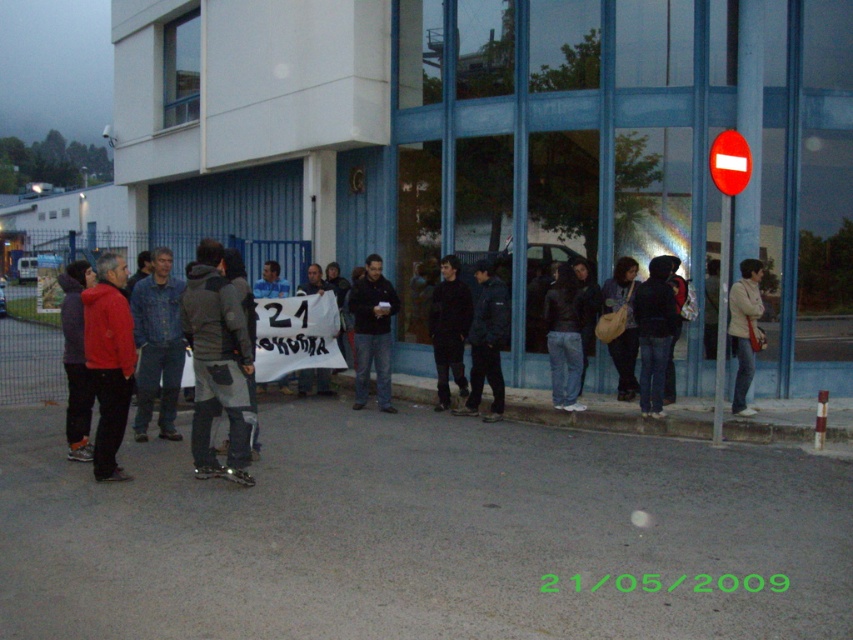
You are standing at the center of the image and want to find the dark blue jacket at center. In which direction should you look to see it?

The dark blue jacket at center is located at the center of the image, so you should look straight ahead to see it.

You are standing on the sidewalk and see the dark blue jeans at center and the light beige jacket at center. Which one is positioned more to the left side?

The dark blue jeans at center is positioned more to the left side than the light beige jacket at center.

You are a photographer trying to capture a clear shot of the dark blue jacket at center without the dark blue jeans at center blocking it. Based on their positions, is this possible?

The dark blue jeans at center is in front of the dark blue jacket at center, so it would block the view. Move closer or reposition to avoid the jeans at center.